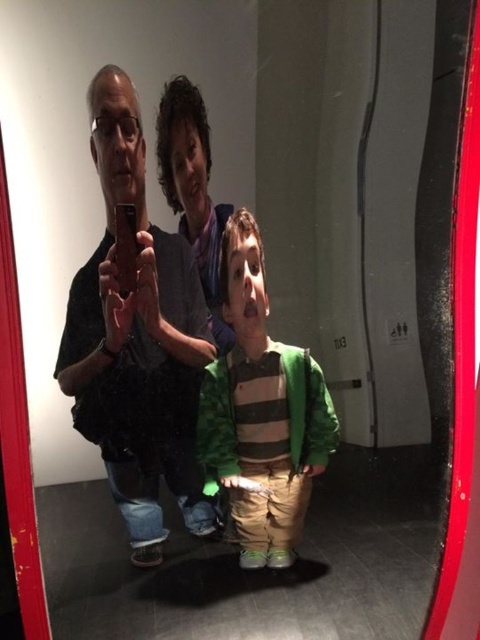
You are a photographer trying to edit this image. You want to ensure that both the matte black shirt at left and the green striped sweater at center are clearly visible. Which clothing item should you adjust the focus on first to ensure it stands out more?

The matte black shirt at left is larger in size than the green striped sweater at center, so you should adjust the focus on the matte black shirt at left first to ensure it stands out more.